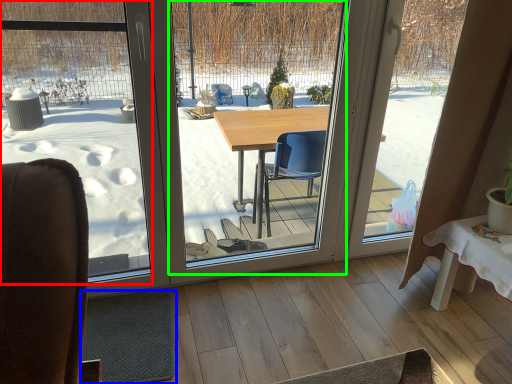
Question: Which object is positioned farthest from window screen (highlighted by a red box)? Select from flat (highlighted by a blue box) and window screen (highlighted by a green box).

Choices:
 (A) flat
 (B) window screen

Answer: (B)